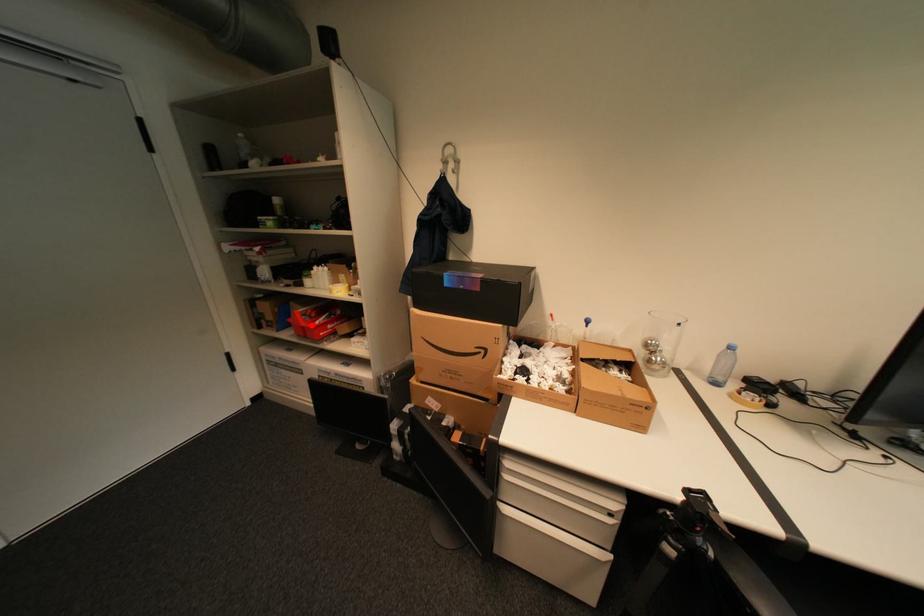
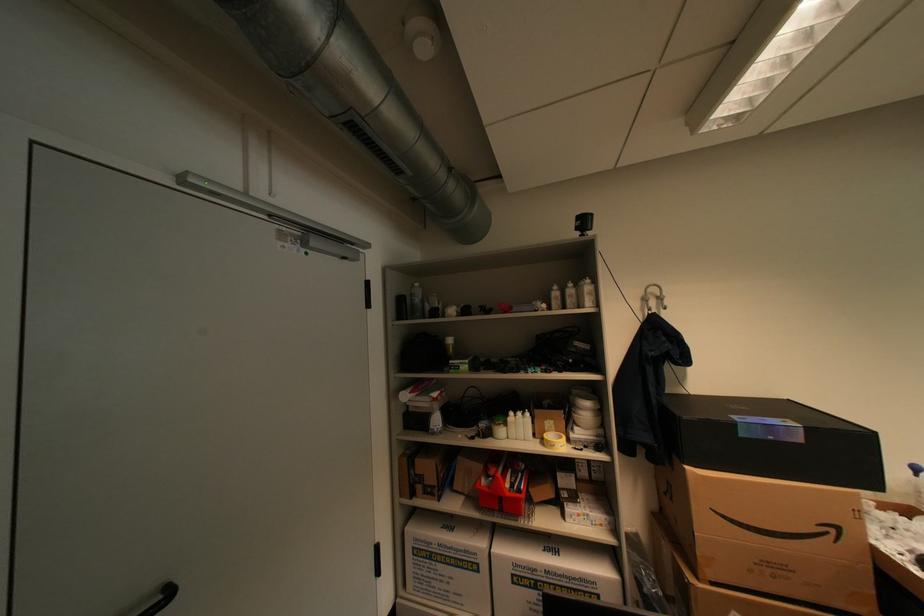
Question: A red point is marked in image1. In image2, is the corresponding 3D point closer to the camera or farther? Reply with the corresponding letter.

Choices:
 (A) The corresponding 3D point is closer.
 (B) The corresponding 3D point is farther.

Answer: (B)